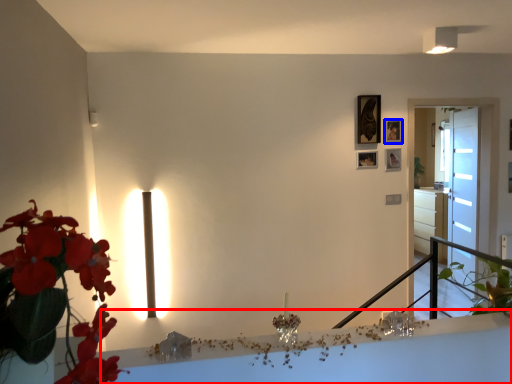
Question: Which object appears farthest to the camera in this image, table (highlighted by a red box) or picture frame (highlighted by a blue box)?

Choices:
 (A) table
 (B) picture frame

Answer: (B)